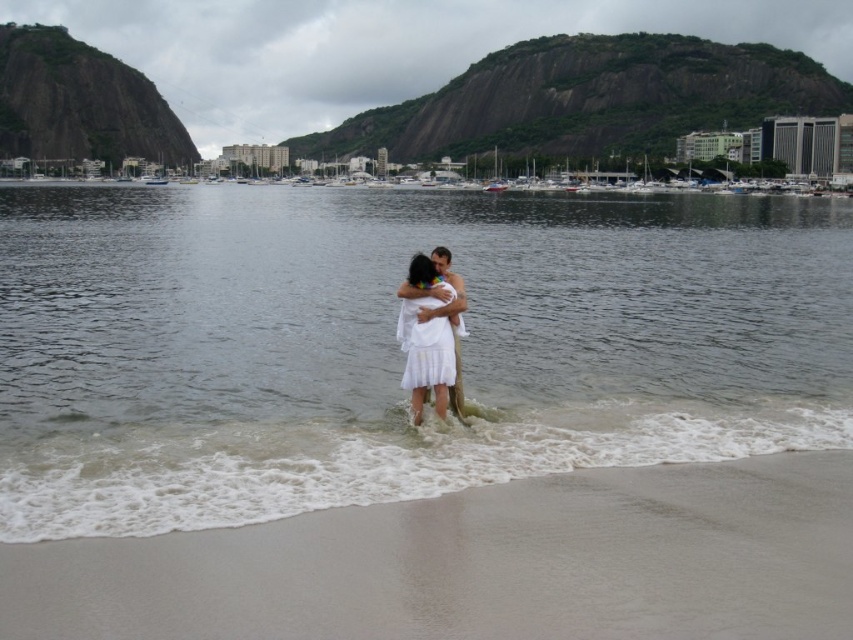
Question: Is clear water at center wider than sandy beach at lower center?

Choices:
 (A) no
 (B) yes

Answer: (B)

Question: Is clear water at center smaller than sandy beach at lower center?

Choices:
 (A) yes
 (B) no

Answer: (B)

Question: Which point is closer to the camera?

Choices:
 (A) sandy beach at lower center
 (B) white satin dress at center
 (C) clear water at center

Answer: (A)

Question: Which point is closer to the camera?

Choices:
 (A) clear water at center
 (B) white satin dress at center

Answer: (A)

Question: Is clear water at center above white satin dress at center?

Choices:
 (A) no
 (B) yes

Answer: (B)

Question: Which is farther from the clear water at center?

Choices:
 (A) sandy beach at lower center
 (B) white satin dress at center

Answer: (A)